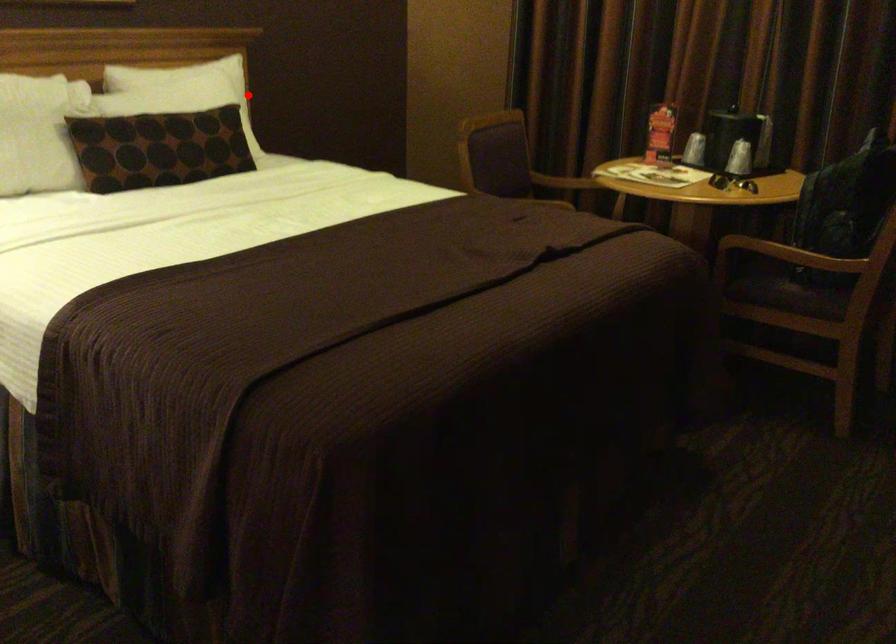
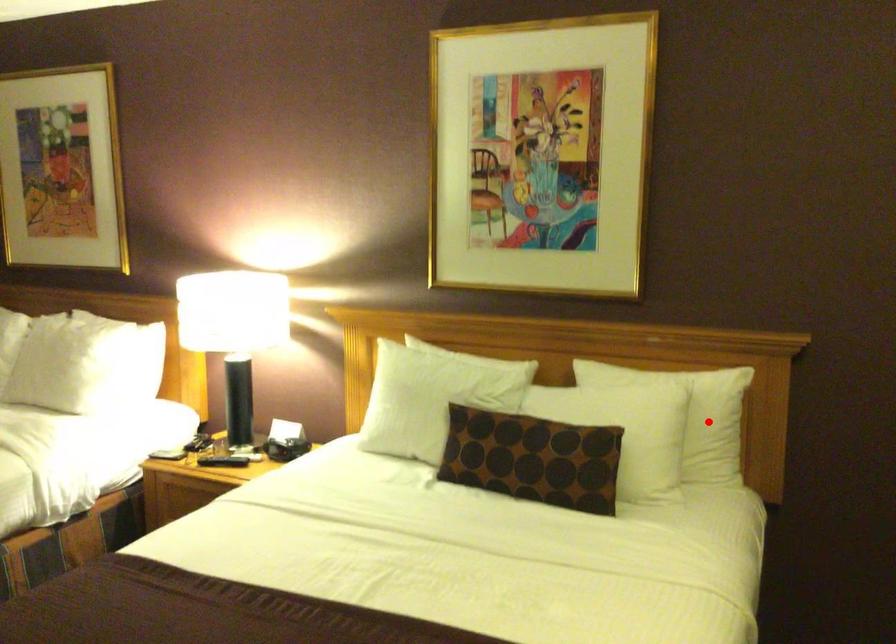
Consider the image. I am providing you with two images of the same scene from different viewpoints. A red point is marked on the first image and another point is marked on the second image. Are the points marked in image1 and image2 representing the same 3D position?

Yes